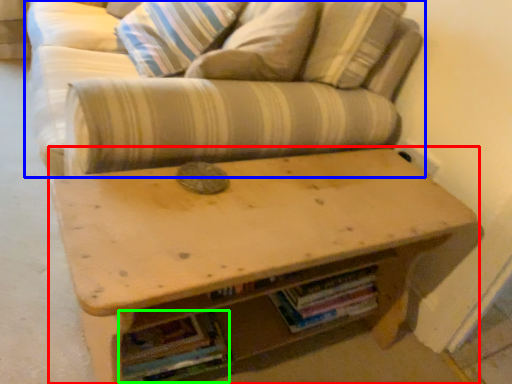
Question: Estimate the real-world distances between objects in this image. Which object is farther from table (highlighted by a red box), studio couch (highlighted by a blue box) or book (highlighted by a green box)?

Choices:
 (A) studio couch
 (B) book

Answer: (B)